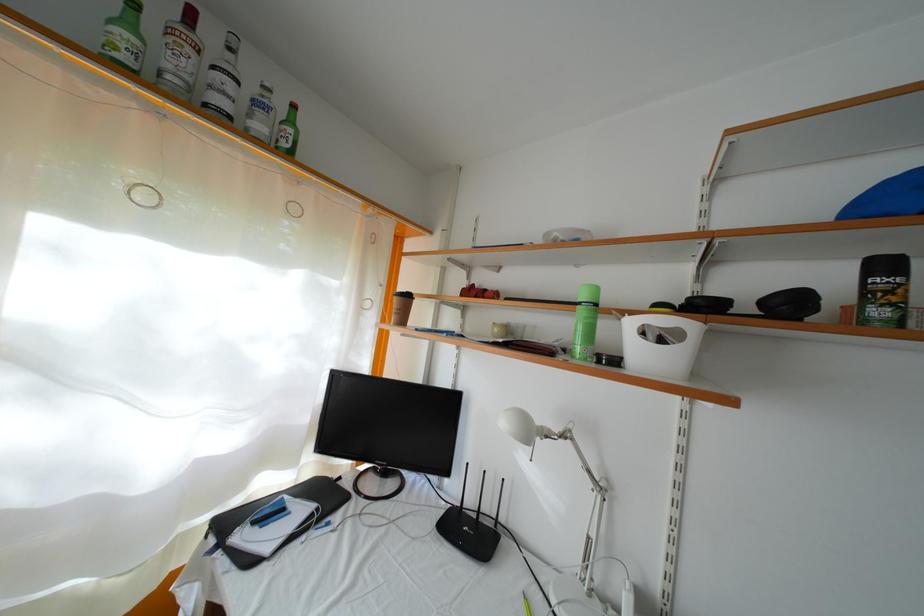
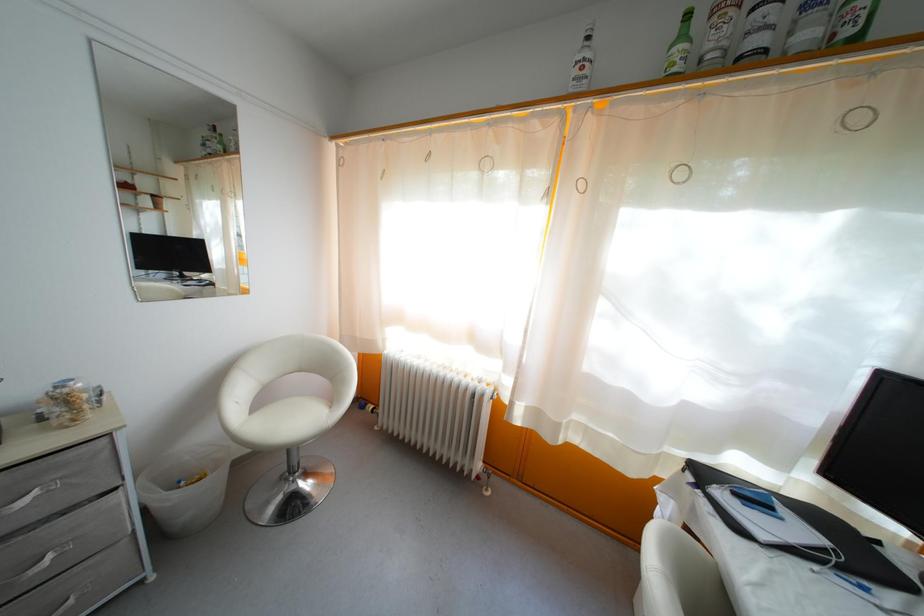
Question: How did the camera likely rotate?

Choices:
 (A) Left
 (B) Right
 (C) Up
 (D) Down

Answer: (A)